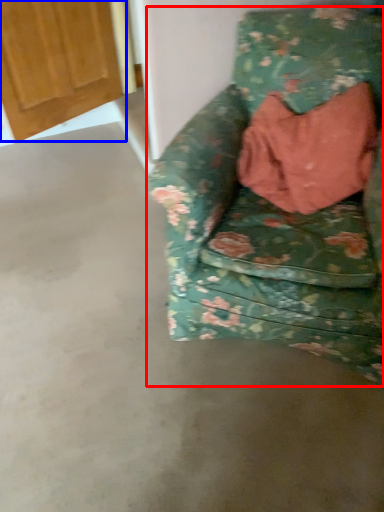
Question: Which point is further to the camera, chair (highlighted by a red box) or door (highlighted by a blue box)?

Choices:
 (A) chair
 (B) door

Answer: (B)